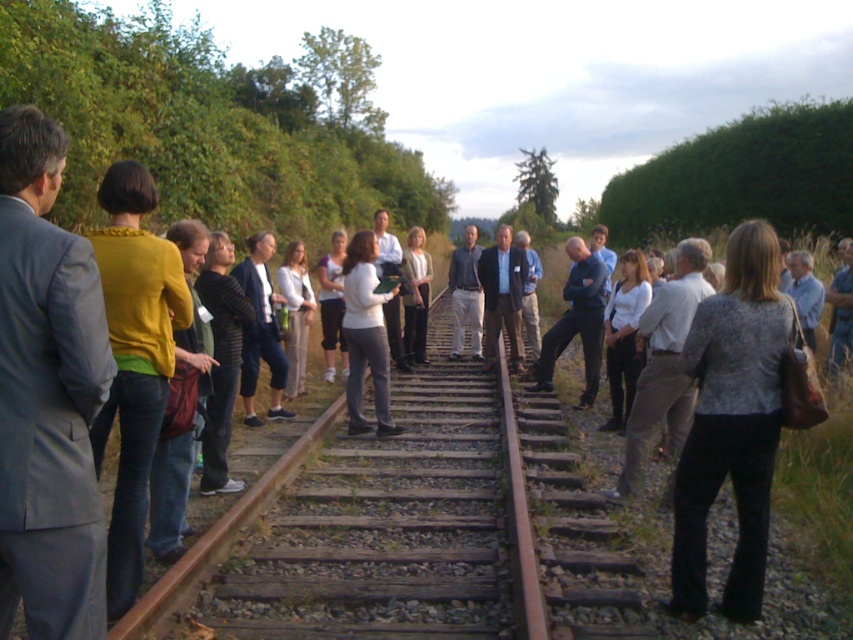
Question: Observing the image, what is the correct spatial positioning of matte yellow sweater at left in reference to white matte shirt at center?

Choices:
 (A) right
 (B) left

Answer: (B)

Question: Does white shirt at center come behind light brown suit at center?

Choices:
 (A) yes
 (B) no

Answer: (B)

Question: Which object is the closest to the white shirt at center?

Choices:
 (A) white matte jacket at center
 (B) light brown suit at center
 (C) dark blue shirt at center

Answer: (A)

Question: Which point is closer to the camera?

Choices:
 (A) patterned fabric jacket at center
 (B) light brown pants at center
 (C) dark blue jeans at center
 (D) white matte jacket at center

Answer: (A)

Question: In this image, where is yellow sweater at left located relative to light brown suit at center?

Choices:
 (A) below
 (B) above

Answer: (A)

Question: Which point is farther to the camera?

Choices:
 (A) (495, 260)
 (B) (387, 314)
 (C) (410, 243)
 (D) (281, 381)

Answer: (C)